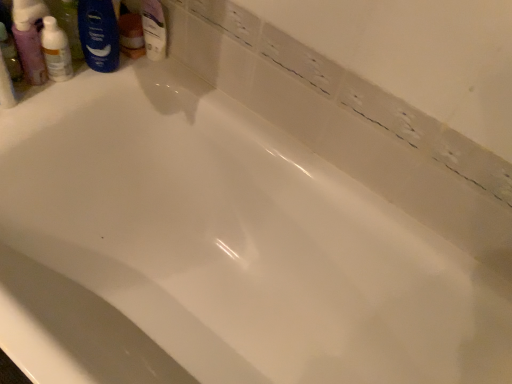
Question: From the image's perspective, is translucent plastic mouthwash at upper left above or below blue matte shaving cream at upper left?

Choices:
 (A) above
 (B) below

Answer: (B)

Question: Is translucent plastic mouthwash at upper left taller or shorter than blue matte shaving cream at upper left?

Choices:
 (A) short
 (B) tall

Answer: (A)

Question: Based on their relative distances, which object is nearer to the blue matte shaving cream at upper left?

Choices:
 (A) translucent plastic mouthwash at upper left
 (B) translucent plastic bottle at upper left

Answer: (B)

Question: Which is farther from the translucent plastic bottle at upper left?

Choices:
 (A) blue matte shaving cream at upper left
 (B) translucent plastic mouthwash at upper left

Answer: (A)